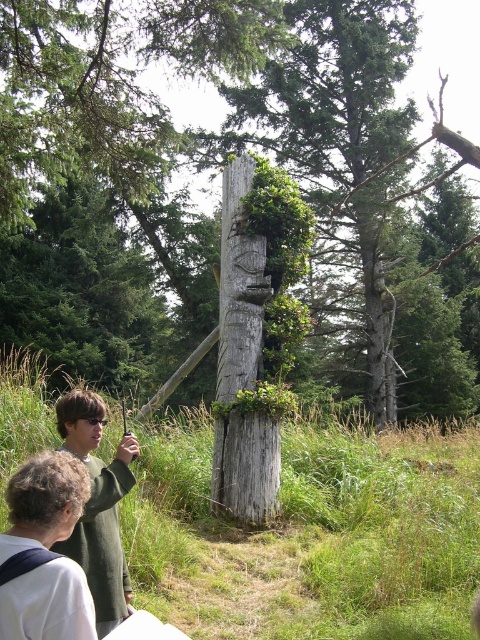
Question: Can you confirm if weathered wood totem at center is bigger than green fabric shirt at lower left?

Choices:
 (A) no
 (B) yes

Answer: (B)

Question: Which of the following is the farthest from the observer?

Choices:
 (A) (206, 65)
 (B) (79, 413)

Answer: (A)

Question: Which point is farther to the camera?

Choices:
 (A) green fabric shirt at lower left
 (B) green wool sweater at lower left

Answer: (B)

Question: Which object appears farthest from the camera in this image?

Choices:
 (A) weathered wood totem at center
 (B) weathered wood totem pole at center
 (C) green fabric shirt at lower left
 (D) green wool sweater at lower left

Answer: (A)

Question: Does green fabric shirt at lower left appear on the right side of green wool sweater at lower left?

Choices:
 (A) no
 (B) yes

Answer: (B)

Question: Is weathered wood totem pole at center further to the viewer compared to green fabric shirt at lower left?

Choices:
 (A) no
 (B) yes

Answer: (B)